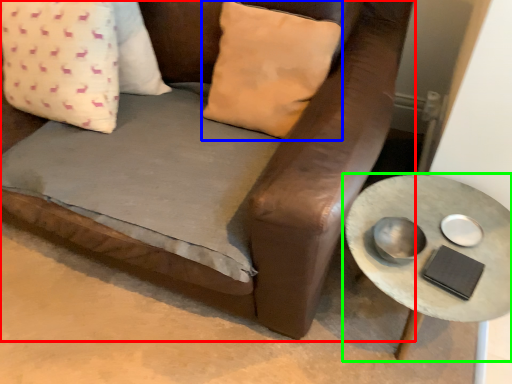
Question: Which is farther away from studio couch (highlighted by a red box)? pillow (highlighted by a blue box) or table (highlighted by a green box)?

Choices:
 (A) pillow
 (B) table

Answer: (B)